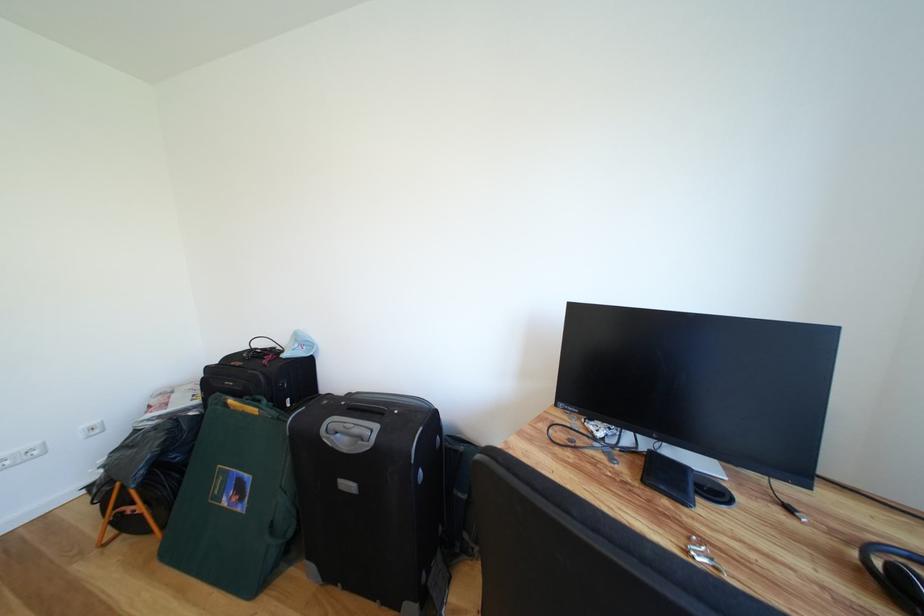
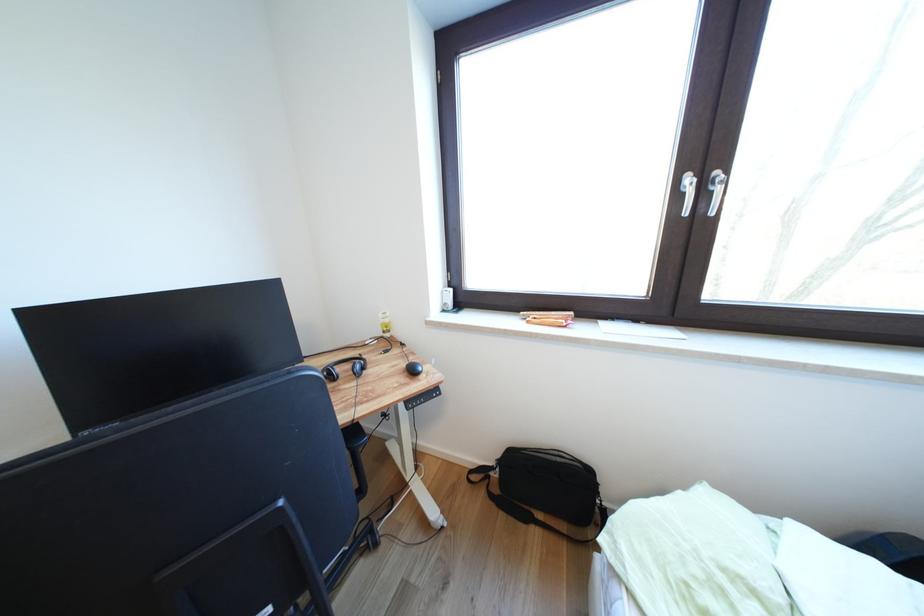
The images are taken continuously from a first-person perspective. In which direction is your viewpoint rotating?

The rotation direction of the camera is right-down.